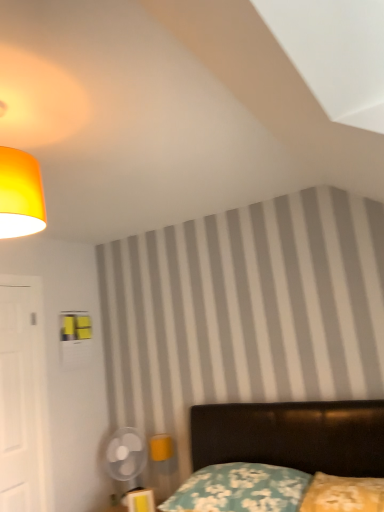
Identify the location of empty space that is ontop of matte yellow lampshade at upper left (from a real-world perspective). The width and height of the screenshot is (384, 512). (13, 103).